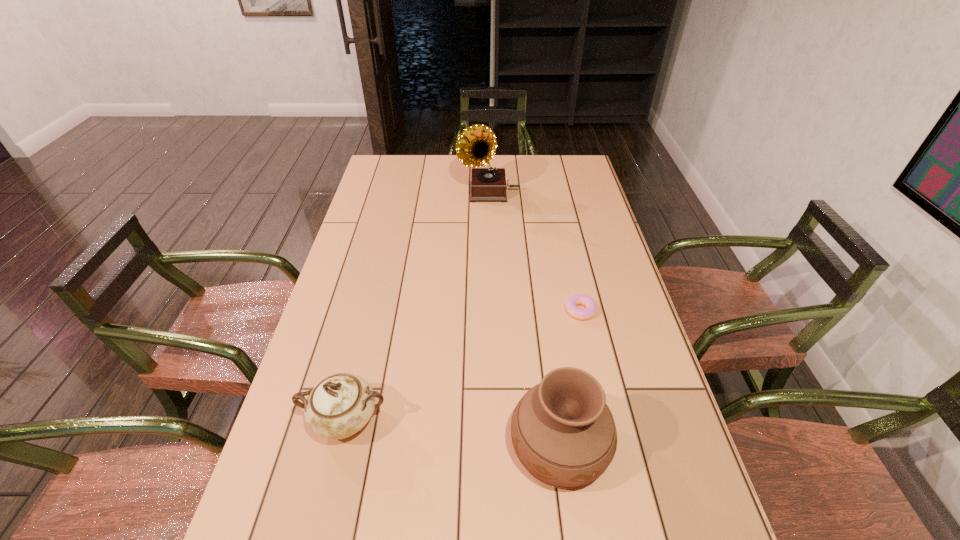
This screenshot has height=540, width=960. I want to click on vacant space that satisfies the following two spatial constraints: 1. from the horn of the farthest object; 2. on the front side of the leftmost object, so pyautogui.click(x=494, y=420).

Identify the location of vacant space that satisfies the following two spatial constraints: 1. from the horn of the farthest object; 2. on the right side of the doughnut. The width and height of the screenshot is (960, 540). (492, 310).

In order to click on free point that satisfies the following two spatial constraints: 1. from the horn of the farthest object; 2. on the left side of the doughnut in this screenshot , I will do `click(492, 310)`.